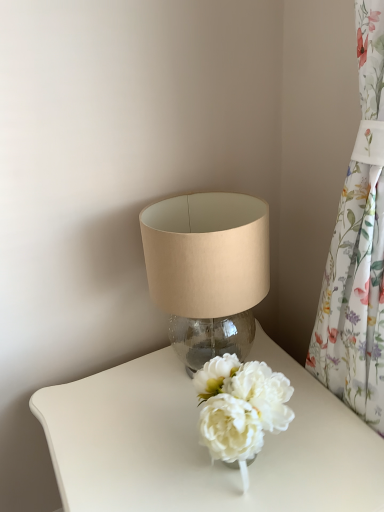
Question: Does floral fabric curtain at right come behind white glossy table at center?

Choices:
 (A) yes
 (B) no

Answer: (B)

Question: Can you confirm if floral fabric curtain at right is bigger than white glossy table at center?

Choices:
 (A) yes
 (B) no

Answer: (B)

Question: Could you tell me if floral fabric curtain at right is turned towards white glossy table at center?

Choices:
 (A) yes
 (B) no

Answer: (A)

Question: Is floral fabric curtain at right not close to white glossy table at center?

Choices:
 (A) no
 (B) yes

Answer: (A)

Question: Does floral fabric curtain at right have a greater width compared to white glossy table at center?

Choices:
 (A) no
 (B) yes

Answer: (A)

Question: From their relative heights in the image, would you say floral fabric curtain at right is taller or shorter than white glossy table at center?

Choices:
 (A) short
 (B) tall

Answer: (B)

Question: From a real-world perspective, is floral fabric curtain at right positioned above or below white glossy table at center?

Choices:
 (A) above
 (B) below

Answer: (A)

Question: Is point (367, 104) positioned closer to the camera than point (380, 458)?

Choices:
 (A) closer
 (B) farther

Answer: (A)

Question: Is floral fabric curtain at right wider or thinner than white glossy table at center?

Choices:
 (A) wide
 (B) thin

Answer: (B)

Question: From a real-world perspective, is floral fabric curtain at right above or below translucent glass lampshade at upper center?

Choices:
 (A) below
 (B) above

Answer: (B)

Question: In terms of height, does floral fabric curtain at right look taller or shorter compared to translucent glass lampshade at upper center?

Choices:
 (A) short
 (B) tall

Answer: (B)

Question: Is floral fabric curtain at right bigger or smaller than translucent glass lampshade at upper center?

Choices:
 (A) big
 (B) small

Answer: (A)

Question: Considering the relative positions of floral fabric curtain at right and translucent glass lampshade at upper center in the image provided, is floral fabric curtain at right to the left or to the right of translucent glass lampshade at upper center?

Choices:
 (A) left
 (B) right

Answer: (B)

Question: From the image's perspective, is translucent glass lampshade at upper center located above or below white glossy table at center?

Choices:
 (A) above
 (B) below

Answer: (A)

Question: Is translucent glass lampshade at upper center bigger or smaller than white glossy table at center?

Choices:
 (A) big
 (B) small

Answer: (B)